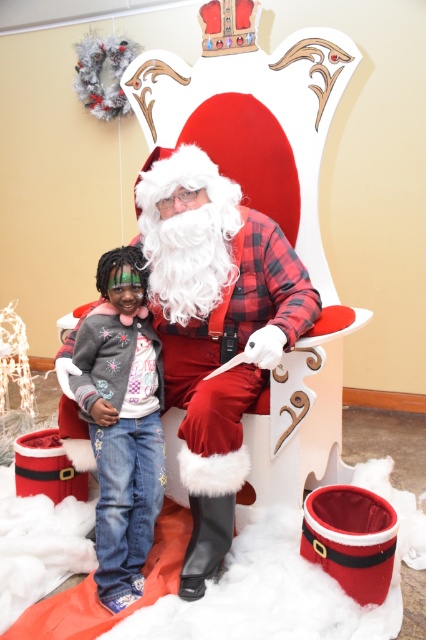
Question: Is fuzzy white beard at center behind denim jacket at lower left?

Choices:
 (A) yes
 (B) no

Answer: (B)

Question: Is fuzzy white beard at center to the left of denim jacket at lower left from the viewer's perspective?

Choices:
 (A) yes
 (B) no

Answer: (B)

Question: Among these points, which one is farthest from the camera?

Choices:
 (A) (120, 420)
 (B) (264, 276)

Answer: (B)

Question: Which of the following is the closest to the observer?

Choices:
 (A) denim jacket at lower left
 (B) fuzzy white beard at center

Answer: (B)

Question: Is fuzzy white beard at center bigger than denim jacket at lower left?

Choices:
 (A) no
 (B) yes

Answer: (B)